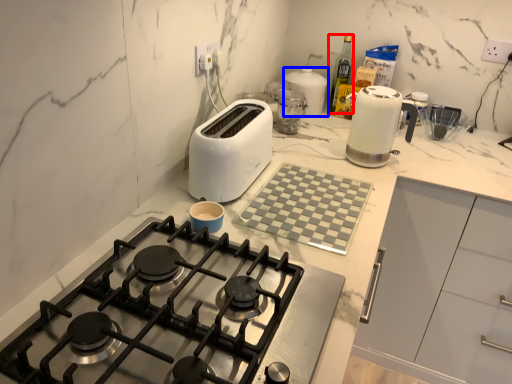
Question: Which of the following is the farthest to the observer, bottle (highlighted by a red box) or kitchen appliance (highlighted by a blue box)?

Choices:
 (A) bottle
 (B) kitchen appliance

Answer: (A)